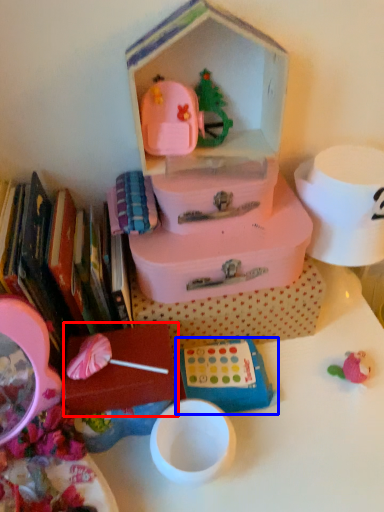
Question: Which object is closer to the camera taking this photo, storage box (highlighted by a red box) or toy (highlighted by a blue box)?

Choices:
 (A) storage box
 (B) toy

Answer: (A)